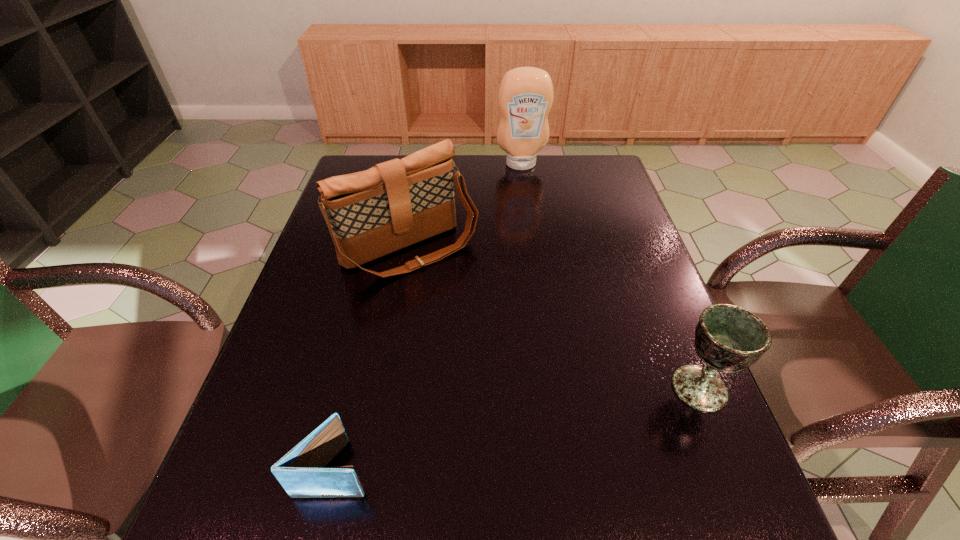
Find the location of a particular element. The image size is (960, 540). object that is at the right edge is located at coordinates coord(728,338).

The image size is (960, 540). Identify the location of object situated at the near left corner. (301, 472).

This screenshot has height=540, width=960. In the image, there is a desktop. In order to click on vacant space at the far edge in this screenshot , I will do `click(454, 164)`.

The width and height of the screenshot is (960, 540). In the image, there is a desktop. Identify the location of vacant area at the near edge. (498, 433).

Where is `vacant space at the left edge`? The height and width of the screenshot is (540, 960). vacant space at the left edge is located at coordinates (311, 261).

In the image, there is a desktop. Identify the location of vacant space at the right edge. The image size is (960, 540). (652, 280).

Find the location of `vacant region at the far left corner`. vacant region at the far left corner is located at coordinates (366, 167).

Find the location of a particular element. This screenshot has width=960, height=540. blank space at the near right corner is located at coordinates (649, 439).

Image resolution: width=960 pixels, height=540 pixels. What are the coordinates of `vacant point located between the rightmost object and the tallest object` in the screenshot? It's located at (611, 276).

Find the location of a particular element. free spot between the third nearest object and the wallet is located at coordinates tap(372, 359).